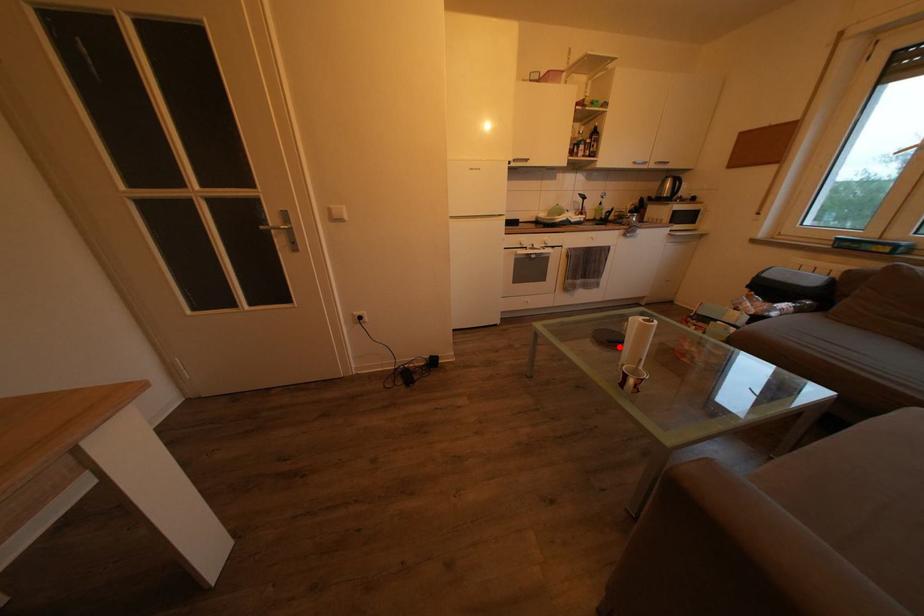
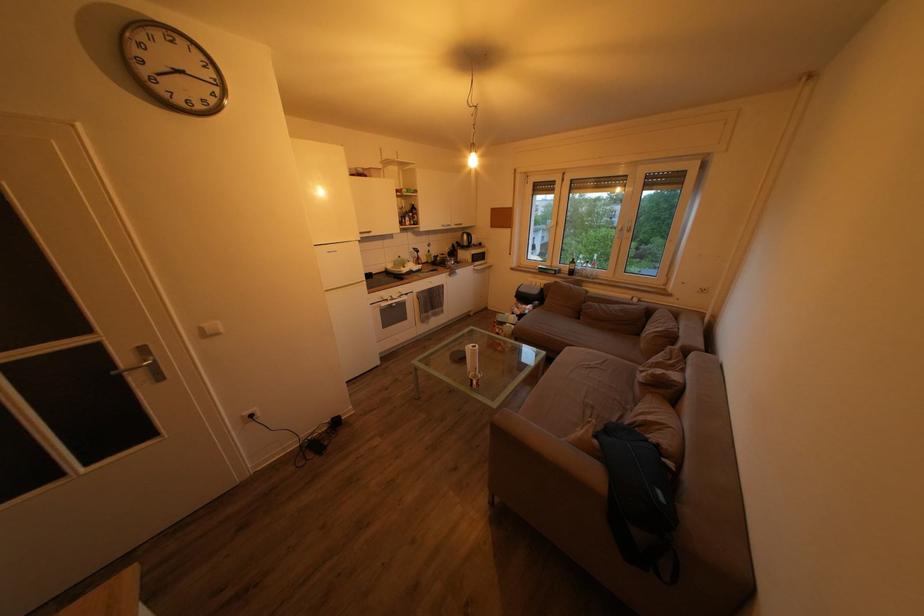
Question: I am providing you with two images of the same scene from different viewpoints. In image1, a red point is highlighted. Considering the same 3D point in image2, which of the following is correct?

Choices:
 (A) It is closer
 (B) It is farther

Answer: (B)